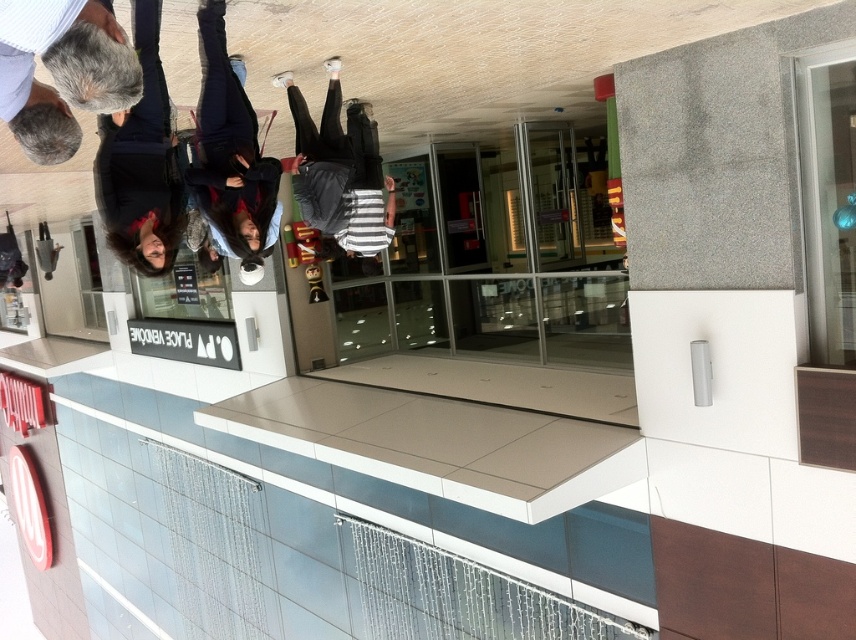
You are a customer at the counter and need to place your order. The cashier points to the gray wool sweater at upper left and says it is blocking the order form. Can you move it to the right side of the counter?

The gray wool sweater at upper left is located at point (61,72), which is on the left side of the counter. Moving it to the right side would require shifting it horizontally to the right from its current position.

From the picture: You are standing at the counter in the image and need to place an order. There are two points marked on the counter. One is at point (128, 230) and the other is at point (229, 92). Which point is closer to you as you face the counter?

Point (128, 230) is in front of point (229, 92), so it is closer to you as you face the counter.